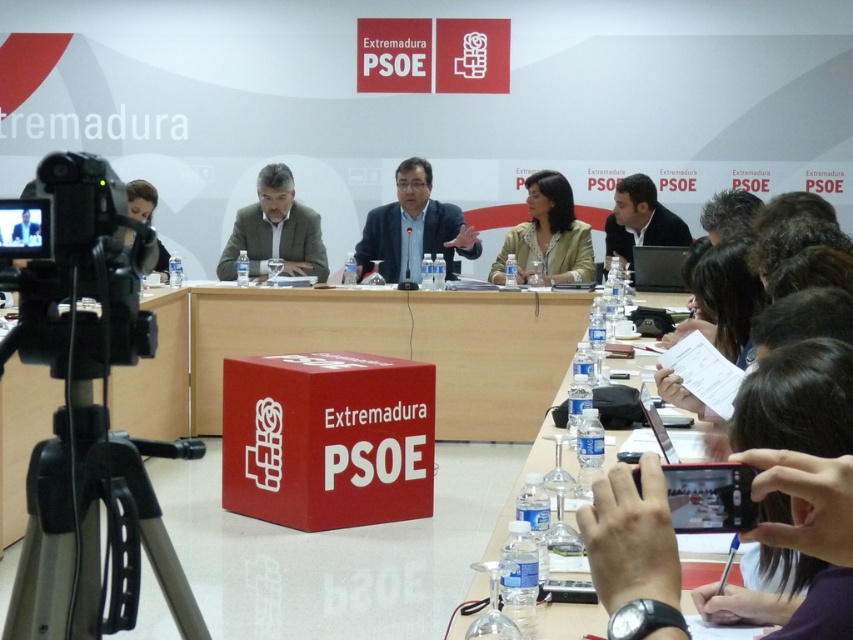
Question: Which point appears farthest from the camera in this image?

Choices:
 (A) (549, 182)
 (B) (614, 212)

Answer: (B)

Question: Which point is farther to the camera?

Choices:
 (A) light brown leather jacket at center
 (B) black plastic phone at lower right

Answer: (A)

Question: Is red plastic table at center to the right of matte black hair at upper left from the viewer's perspective?

Choices:
 (A) no
 (B) yes

Answer: (B)

Question: Which of these objects is positioned farthest from the wooden table at center?

Choices:
 (A) red plastic table at center
 (B) matte black hair at upper left
 (C) light brown leather jacket at center
 (D) blue shirt at center

Answer: (B)

Question: Where is black plastic phone at lower right located in relation to blue shirt at center in the image?

Choices:
 (A) above
 (B) below

Answer: (B)

Question: Can you confirm if black plastic tripod at lower left is positioned below matte black man at center?

Choices:
 (A) no
 (B) yes

Answer: (B)